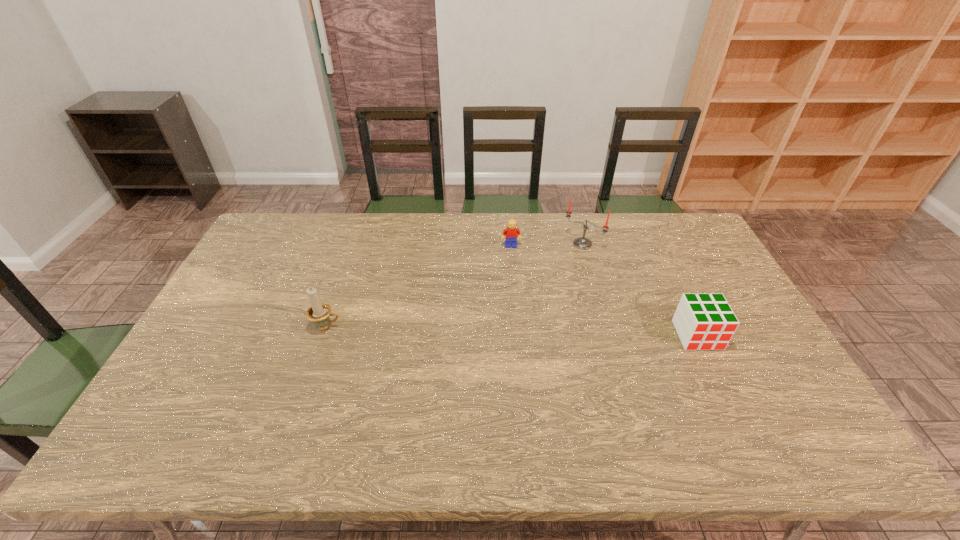
Locate an element on the screen. This screenshot has height=540, width=960. vacant area situated on the front-facing side of the candle is located at coordinates (538, 287).

I want to click on free space located 0.050m on the front-facing side of the candle, so click(x=566, y=259).

This screenshot has width=960, height=540. Identify the location of Lego present at the far edge. (510, 232).

Image resolution: width=960 pixels, height=540 pixels. Find the location of `candle that is at the far edge`. candle that is at the far edge is located at coordinates (581, 242).

The image size is (960, 540). In order to click on object present at the right edge in this screenshot , I will do `click(703, 321)`.

In the image, there is a desktop. Find the location of `free region at the far edge`. free region at the far edge is located at coordinates (564, 221).

Find the location of `blank space at the near edge of the desktop`. blank space at the near edge of the desktop is located at coordinates (288, 397).

Where is `vacant space at the far right corner`? The height and width of the screenshot is (540, 960). vacant space at the far right corner is located at coordinates (689, 251).

This screenshot has width=960, height=540. I want to click on free space at the near right corner of the desktop, so click(x=745, y=389).

At what (x,y) coordinates should I click in order to perform the action: click on free space between the Lego and the leftmost object. Please return your answer as a coordinate pair (x, y). This screenshot has height=540, width=960. Looking at the image, I should click on (419, 287).